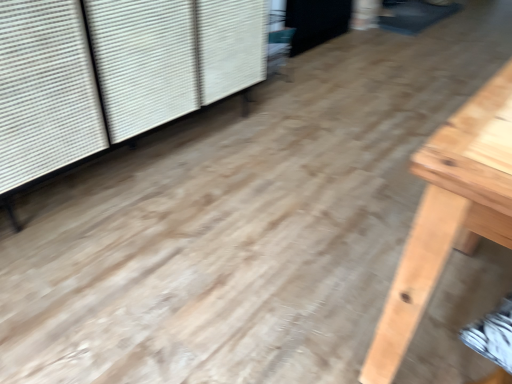
The image size is (512, 384). Find the location of `white textured shutter at upper left`. white textured shutter at upper left is located at coordinates (45, 91).

What is the approximate height of white textured shutter at upper left?

white textured shutter at upper left is 31.90 inches tall.

The image size is (512, 384). What do you see at coordinates (45, 91) in the screenshot?
I see `white textured shutter at upper left` at bounding box center [45, 91].

Locate an element on the screen. black matte screen door at upper center is located at coordinates (316, 22).

The width and height of the screenshot is (512, 384). What do you see at coordinates (316, 22) in the screenshot?
I see `black matte screen door at upper center` at bounding box center [316, 22].

Find the location of a particular element. The image size is (512, 384). white textured shutter at upper left is located at coordinates (45, 91).

Is white textured shutter at upper left to the left of black matte screen door at upper center from the viewer's perspective?

Indeed, white textured shutter at upper left is positioned on the left side of black matte screen door at upper center.

Which object is closer to the camera, white textured shutter at upper left or black matte screen door at upper center?

white textured shutter at upper left is more forward.

Which point is more distant from viewer, [69,5] or [289,53]?

The point [289,53] is farther.

From the image's perspective, does white textured shutter at upper left appear lower than black matte screen door at upper center?

Indeed, from the image's perspective, white textured shutter at upper left is shown beneath black matte screen door at upper center.

Based on the photo, from a real-world perspective, is white textured shutter at upper left located higher than black matte screen door at upper center?

Yes, from a real-world perspective, white textured shutter at upper left is above black matte screen door at upper center.

Does white textured shutter at upper left have a lesser width compared to black matte screen door at upper center?

In fact, white textured shutter at upper left might be wider than black matte screen door at upper center.

Considering the sizes of objects white textured shutter at upper left and black matte screen door at upper center in the image provided, who is taller, white textured shutter at upper left or black matte screen door at upper center?

white textured shutter at upper left is taller.

Looking at the image, does white textured shutter at upper left seem bigger or smaller compared to black matte screen door at upper center?

In the image, white textured shutter at upper left appears to be larger than black matte screen door at upper center.

Is white textured shutter at upper left positioned beyond the bounds of black matte screen door at upper center?

That's correct, white textured shutter at upper left is outside of black matte screen door at upper center.

Is white textured shutter at upper left not near black matte screen door at upper center?

Yes, white textured shutter at upper left is far from black matte screen door at upper center.

Is black matte screen door at upper center at the back of white textured shutter at upper left?

white textured shutter at upper left does not have its back to black matte screen door at upper center.

How much distance is there between white textured shutter at upper left and black matte screen door at upper center?

white textured shutter at upper left is 4.97 feet away from black matte screen door at upper center.

The image size is (512, 384). Find the location of `screen door behind the white textured shutter at upper left`. screen door behind the white textured shutter at upper left is located at coordinates (316, 22).

Considering the relative positions of black matte screen door at upper center and white textured shutter at upper left in the image provided, is black matte screen door at upper center to the left of white textured shutter at upper left from the viewer's perspective?

Incorrect, black matte screen door at upper center is not on the left side of white textured shutter at upper left.

Is black matte screen door at upper center closer to camera compared to white textured shutter at upper left?

No, it is behind white textured shutter at upper left.

Is point (330, 21) closer or farther from the camera than point (179, 89)?

Point (330, 21) is positioned farther from the camera compared to point (179, 89).

From the image's perspective, between black matte screen door at upper center and white textured shutter at upper left, which one is located above?

black matte screen door at upper center.

Looking at this image, from a real-world perspective, which object stands above the other?

In real-world perspective, white textured shutter at upper left is above.

Can you confirm if black matte screen door at upper center is thinner than white textured shutter at upper left?

Indeed, black matte screen door at upper center has a lesser width compared to white textured shutter at upper left.

In terms of height, does black matte screen door at upper center look taller or shorter compared to white textured shutter at upper left?

In the image, black matte screen door at upper center appears to be shorter than white textured shutter at upper left.

Considering the sizes of black matte screen door at upper center and white textured shutter at upper left in the image, is black matte screen door at upper center bigger or smaller than white textured shutter at upper left?

Clearly, black matte screen door at upper center is smaller in size than white textured shutter at upper left.

From the picture: Is black matte screen door at upper center spatially inside white textured shutter at upper left, or outside of it?

The correct answer is: outside.

Are black matte screen door at upper center and white textured shutter at upper left located far from each other?

Indeed, black matte screen door at upper center is not near white textured shutter at upper left.

Could you tell me if black matte screen door at upper center is turned towards white textured shutter at upper left?

No, black matte screen door at upper center does not turn towards white textured shutter at upper left.

The width and height of the screenshot is (512, 384). Find the location of `screen door lying above the white textured shutter at upper left (from the image's perspective)`. screen door lying above the white textured shutter at upper left (from the image's perspective) is located at coordinates (316, 22).

Locate an element on the screen. screen door located underneath the white textured shutter at upper left (from a real-world perspective) is located at coordinates (316, 22).

At what (x,y) coordinates should I click in order to perform the action: click on screen door behind the white textured shutter at upper left. Please return your answer as a coordinate pair (x, y). The width and height of the screenshot is (512, 384). Looking at the image, I should click on (x=316, y=22).